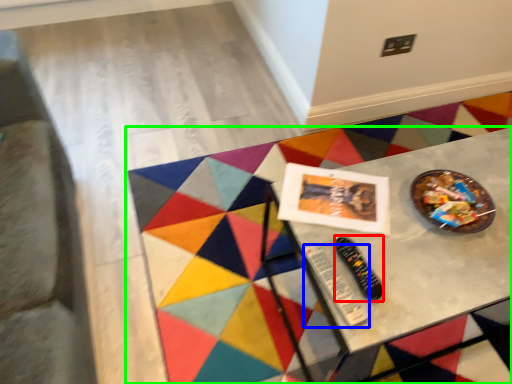
Question: Which is farther away from control (highlighted by a red box)? control (highlighted by a blue box) or table (highlighted by a green box)?

Choices:
 (A) control
 (B) table

Answer: (B)